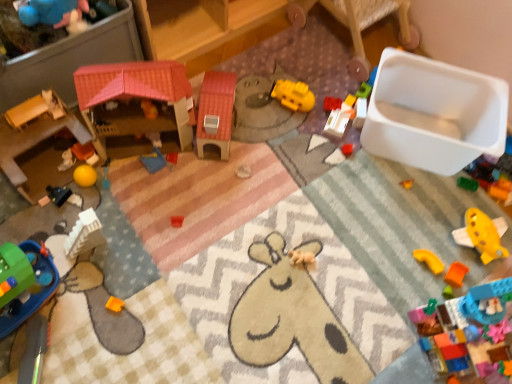
The image size is (512, 384). In order to click on vacant space in between green plastic toy at lower left, acting as the second toy starting from the left, and translucent blue plastic blocks at lower right, the third toy viewed from the right in this screenshot , I will do `click(242, 319)`.